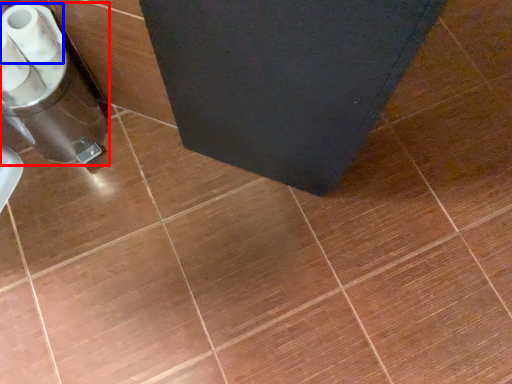
Question: Which object is further to the camera taking this photo, appliance (highlighted by a red box) or toilet paper (highlighted by a blue box)?

Choices:
 (A) appliance
 (B) toilet paper

Answer: (A)